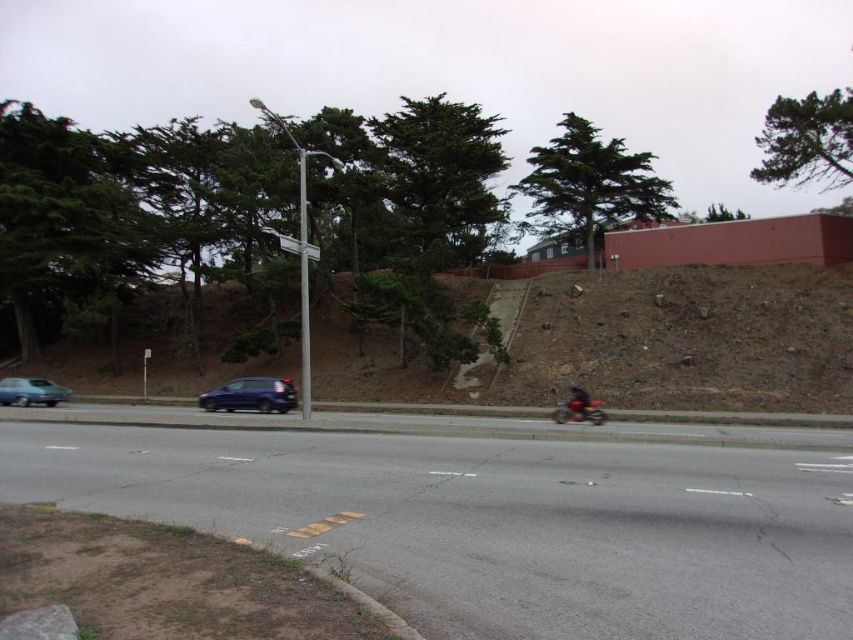
Question: Estimate the real-world distances between objects in this image. Which object is farther from the satin blue hatchback at center?

Choices:
 (A) shiny black motorcycle at right
 (B) white plastic street sign at upper center
 (C) green textured tree at upper center

Answer: (C)

Question: Can you confirm if satin blue hatchback at center is smaller than orange matte motorcycle at center-right?

Choices:
 (A) no
 (B) yes

Answer: (B)

Question: Is green leafy tree at upper center further to camera compared to satin blue hatchback at center?

Choices:
 (A) no
 (B) yes

Answer: (B)

Question: Which point appears farthest from the camera in this image?

Choices:
 (A) (289, 241)
 (B) (846, 152)

Answer: (B)

Question: Which point is closer to the camera?

Choices:
 (A) (410, 113)
 (B) (585, 163)
 (C) (48, 401)

Answer: (C)

Question: Is green leafy tree at upper center below green leafy tree at upper right?

Choices:
 (A) yes
 (B) no

Answer: (B)